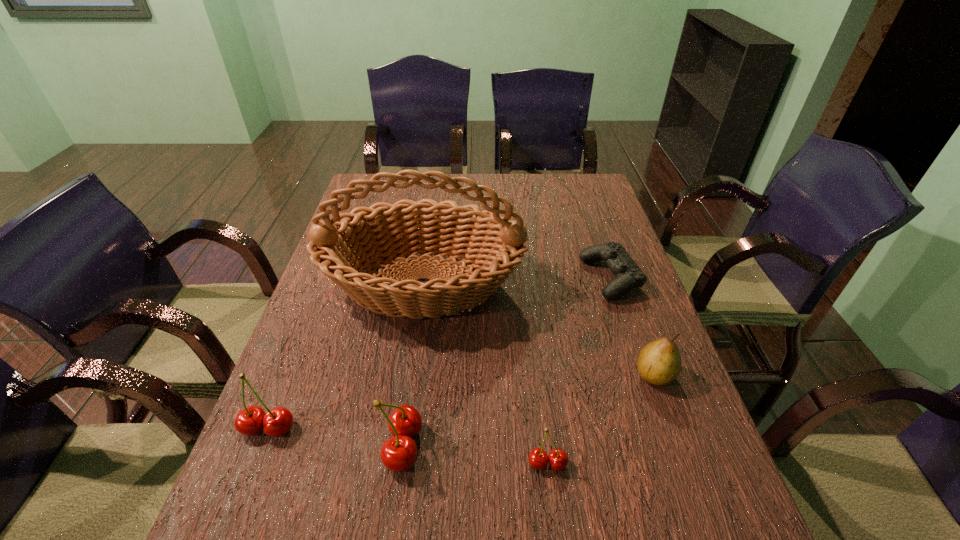
Where is `vacant area that lies between the shortest object and the fourth shortest object`? The height and width of the screenshot is (540, 960). vacant area that lies between the shortest object and the fourth shortest object is located at coordinates (440, 353).

The image size is (960, 540). I want to click on free spot between the tallest object and the pear, so click(539, 329).

Locate an element on the screen. vacant space that's between the control and the second cherry from right to left is located at coordinates (507, 362).

What are the coordinates of `free space between the basket and the second shortest object` in the screenshot? It's located at (485, 374).

Point out which object is positioned as the nearest to the basket. Please provide its 2D coordinates. Your answer should be formatted as a tuple, i.e. [(x, y)], where the tuple contains the x and y coordinates of a point satisfying the conditions above.

[(628, 275)]

Locate which object ranks fifth in proximity to the control. Please provide its 2D coordinates. Your answer should be formatted as a tuple, i.e. [(x, y)], where the tuple contains the x and y coordinates of a point satisfying the conditions above.

[(251, 420)]

Choose which cherry is the second nearest neighbor to the shortest object. Please provide its 2D coordinates. Your answer should be formatted as a tuple, i.e. [(x, y)], where the tuple contains the x and y coordinates of a point satisfying the conditions above.

[(398, 453)]

Select which cherry is the third closest to the basket. Please provide its 2D coordinates. Your answer should be formatted as a tuple, i.e. [(x, y)], where the tuple contains the x and y coordinates of a point satisfying the conditions above.

[(538, 458)]